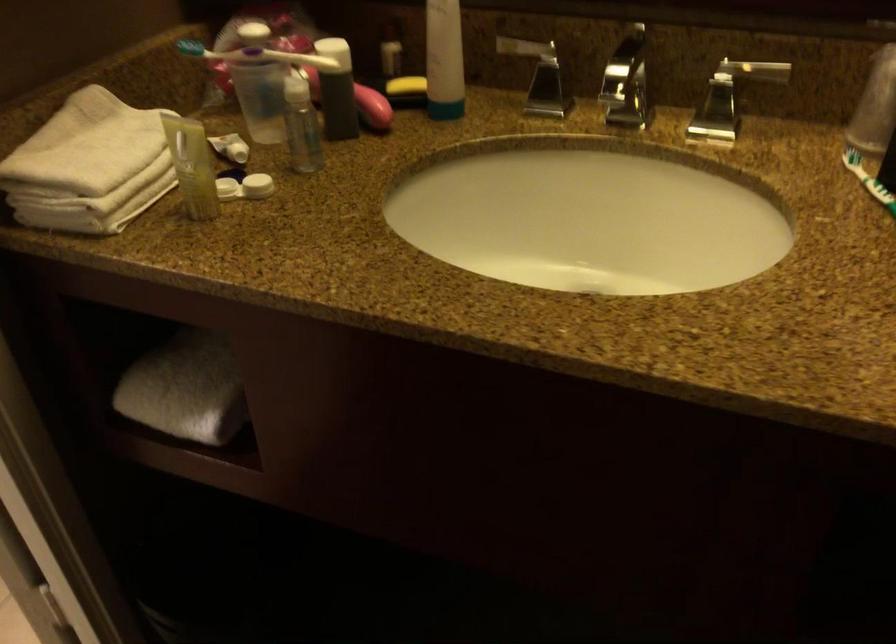
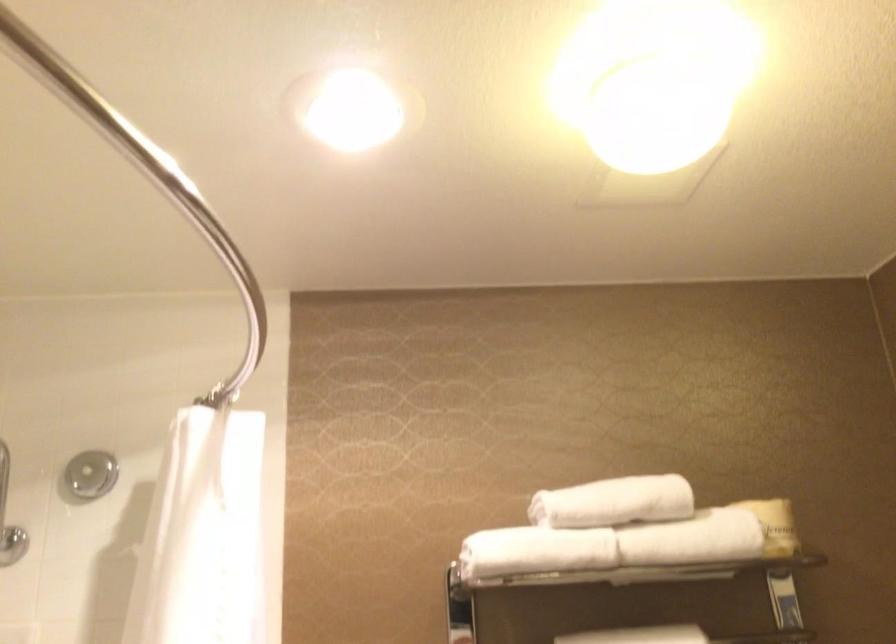
How did the camera likely rotate?

The camera's rotation is toward left-up.